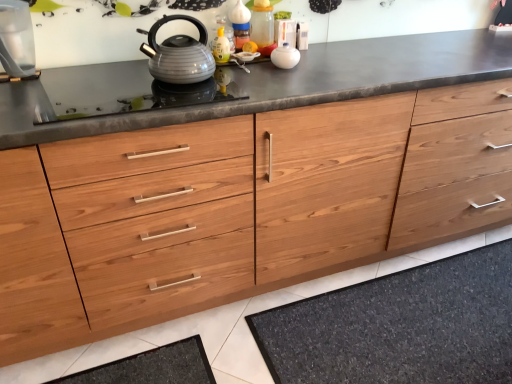
The image size is (512, 384). Identify the location of vacant area to the right of black glass gas stove at center. (265, 79).